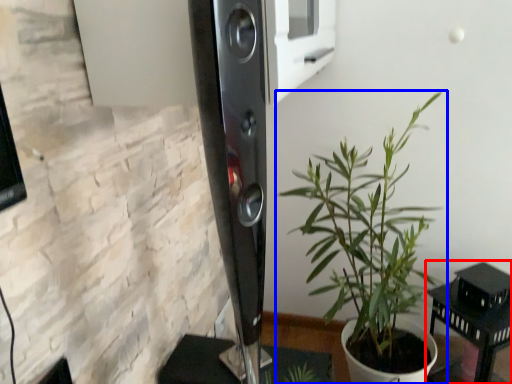
Question: Which of the following is the closest to the observer, furniture (highlighted by a red box) or houseplant (highlighted by a blue box)?

Choices:
 (A) furniture
 (B) houseplant

Answer: (B)